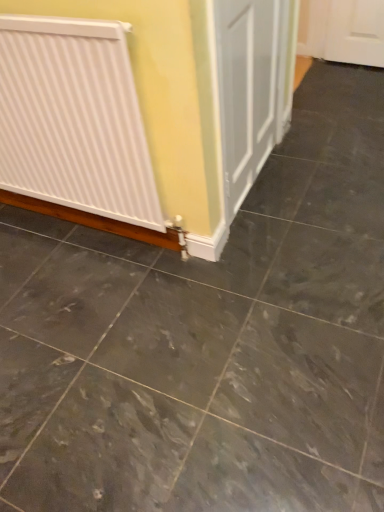
The image size is (384, 512). I want to click on free space above gray marble floor at center (from a real-world perspective), so click(154, 313).